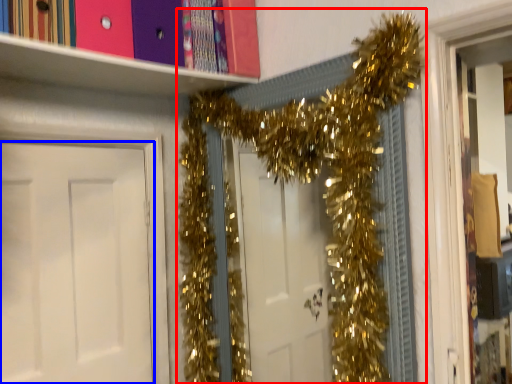
Question: Among these objects, which one is nearest to the camera, christmas decoration (highlighted by a red box) or door (highlighted by a blue box)?

Choices:
 (A) christmas decoration
 (B) door

Answer: (A)